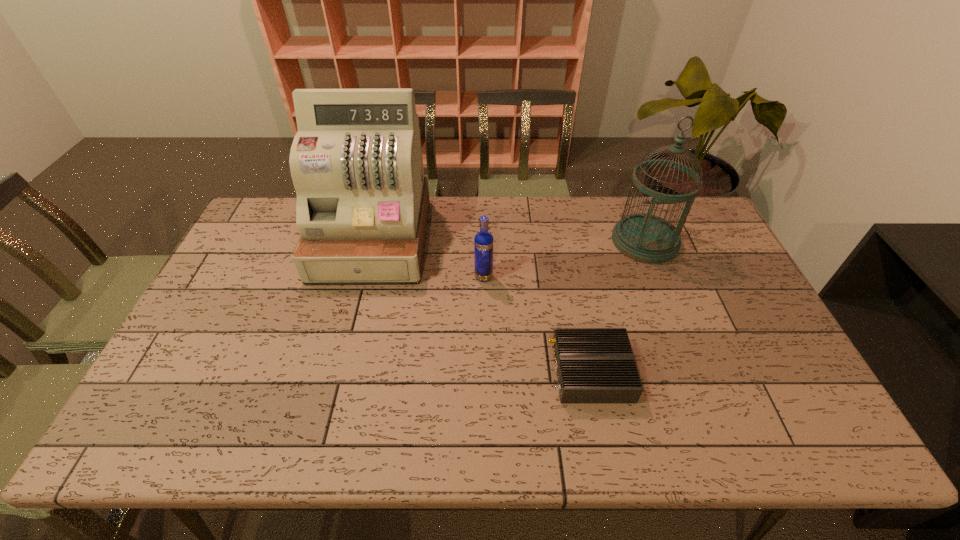
This screenshot has height=540, width=960. In order to click on vacant space in between the vodka and the rightmost object in this screenshot , I will do `click(564, 259)`.

The height and width of the screenshot is (540, 960). I want to click on object that can be found as the second closest to the birdcage, so click(x=483, y=242).

You are a GUI agent. You are given a task and a screenshot of the screen. Output one action in this format:
    pyautogui.click(x=<x>, y=<y>)
    Task: Click on the object that can be found as the closest to the second object from left to right
    The width and height of the screenshot is (960, 540).
    Given the screenshot: What is the action you would take?
    coord(356,163)

Locate an element on the screen. vacant region that satisfies the following two spatial constraints: 1. on the operating side of the vodka; 2. on the right side of the leftmost object is located at coordinates (363, 277).

Where is `free space in the image that satisfies the following two spatial constraints: 1. on the front-facing side of the rightmost object; 2. on the back panel of the router`? The image size is (960, 540). free space in the image that satisfies the following two spatial constraints: 1. on the front-facing side of the rightmost object; 2. on the back panel of the router is located at coordinates click(x=696, y=372).